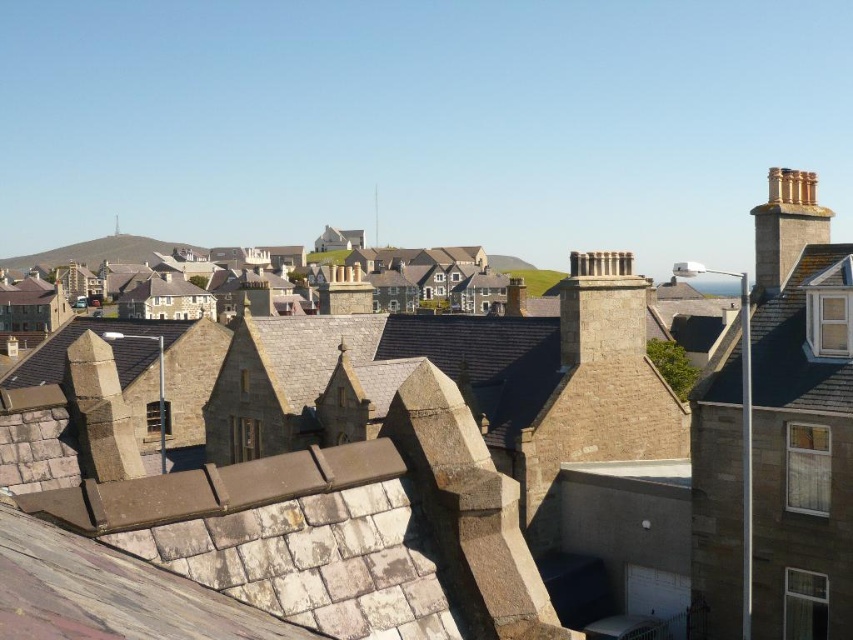
From the picture: You are a drone operator tasked with delivering a package to a rooftop in this residential area. The package must land precisely between the brown stone roof at upper right and the golden stone chimney at upper right. Given that the minimum safe distance for landing is 3 meters from any object, is this landing spot feasible?

The brown stone roof at upper right and golden stone chimney at upper right are 4.90 meters apart. Since the minimum safe distance required is 3 meters from either object, the center point between them would be 2.45 meters away from each, which is less than the required 3 meters. Therefore, the landing spot is not feasible due to insufficient distance from both objects.

You are standing on a rooftop in the residential area and looking down at two points marked in the image. The first point is at coordinates point (819,362) and the second is at point (805,188). Which point is closer to your current position?

Point (819,362) is in front of point (805,188), so it is closer to your current position.

You are standing on a higher building overlooking the residential area. You see the brown stone rooftops at center and the brown stone roof at upper right. Which one is closer to your current position?

The brown stone roof at upper right is closer to your current position because it is above the brown stone rooftops at center.